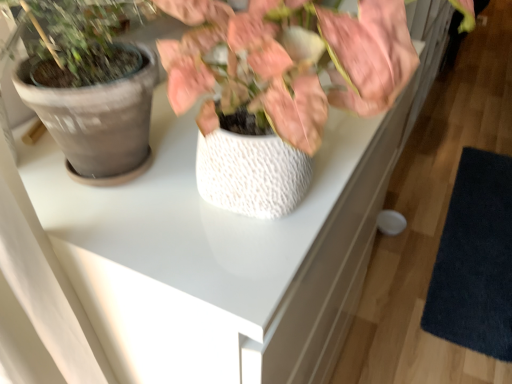
At what (x,y) coordinates should I click in order to perform the action: click on white textured pot at center. Please return your answer as a coordinate pair (x, y). The width and height of the screenshot is (512, 384). Looking at the image, I should click on (289, 61).

Describe the element at coordinates (289, 61) in the screenshot. Image resolution: width=512 pixels, height=384 pixels. I see `white textured pot at center` at that location.

The width and height of the screenshot is (512, 384). Describe the element at coordinates (475, 259) in the screenshot. I see `dark blue textured mat at lower right` at that location.

I want to click on dark blue textured mat at lower right, so click(475, 259).

In order to face dark blue textured mat at lower right, should I rotate leftwards or rightwards?

You should look right and rotate roughly 27.688 degrees.

Locate an element on the screen. white textured pot at center is located at coordinates (289, 61).

Considering the positions of objects white textured pot at center and dark blue textured mat at lower right in the image provided, who is more to the left, white textured pot at center or dark blue textured mat at lower right?

Positioned to the left is white textured pot at center.

Does white textured pot at center lie behind dark blue textured mat at lower right?

That is False.

Considering the points (391, 54) and (449, 308), which point is in front, point (391, 54) or point (449, 308)?

Point (391, 54)

From the image's perspective, is white textured pot at center over dark blue textured mat at lower right?

Indeed, from the image's perspective, white textured pot at center is shown above dark blue textured mat at lower right.

From a real-world perspective, which is physically above, white textured pot at center or dark blue textured mat at lower right?

white textured pot at center, from a real-world perspective.

Which object is thinner, white textured pot at center or dark blue textured mat at lower right?

Thinner between the two is white textured pot at center.

Is white textured pot at center taller than dark blue textured mat at lower right?

Yes, white textured pot at center is taller than dark blue textured mat at lower right.

Between white textured pot at center and dark blue textured mat at lower right, which one has smaller size?

With smaller size is white textured pot at center.

Is white textured pot at center located outside dark blue textured mat at lower right?

Yes, white textured pot at center is not within dark blue textured mat at lower right.

Are white textured pot at center and dark blue textured mat at lower right far apart?

Yes, white textured pot at center is far from dark blue textured mat at lower right.

From the picture: Does white textured pot at center turn towards dark blue textured mat at lower right?

No.

How far apart are white textured pot at center and dark blue textured mat at lower right?

A distance of 5.22 feet exists between white textured pot at center and dark blue textured mat at lower right.

In order to click on mat located behind the white textured pot at center in this screenshot , I will do `click(475, 259)`.

Is dark blue textured mat at lower right at the left side of white textured pot at center?

No.

Is dark blue textured mat at lower right in front of white textured pot at center?

That is False.

Is point (424, 322) positioned behind point (297, 37)?

Yes, point (424, 322) is behind point (297, 37).

From the image's perspective, is dark blue textured mat at lower right located above white textured pot at center?

No, from the image's perspective, dark blue textured mat at lower right is not above white textured pot at center.

From a real-world perspective, does dark blue textured mat at lower right sit lower than white textured pot at center?

Yes, from a real-world perspective, dark blue textured mat at lower right is beneath white textured pot at center.

Can you confirm if dark blue textured mat at lower right is thinner than white textured pot at center?

In fact, dark blue textured mat at lower right might be wider than white textured pot at center.

Which of these two, dark blue textured mat at lower right or white textured pot at center, stands taller?

With more height is white textured pot at center.

Based on their sizes in the image, would you say dark blue textured mat at lower right is bigger or smaller than white textured pot at center?

Clearly, dark blue textured mat at lower right is larger in size than white textured pot at center.

Can we say dark blue textured mat at lower right lies outside white textured pot at center?

Indeed, dark blue textured mat at lower right is completely outside white textured pot at center.

Is dark blue textured mat at lower right positioned far away from white textured pot at center?

dark blue textured mat at lower right is far away from white textured pot at center.

Could you tell me if dark blue textured mat at lower right is facing white textured pot at center?

No, dark blue textured mat at lower right does not turn towards white textured pot at center.

How far apart are dark blue textured mat at lower right and white textured pot at center?

dark blue textured mat at lower right is 1.59 meters away from white textured pot at center.

Where is `houseplant above the dark blue textured mat at lower right (from a real-world perspective)`? The width and height of the screenshot is (512, 384). houseplant above the dark blue textured mat at lower right (from a real-world perspective) is located at coordinates (289, 61).

In the image, there is a white textured pot at center. Identify the location of mat below it (from the image's perspective). This screenshot has height=384, width=512. (475, 259).

The width and height of the screenshot is (512, 384). I want to click on mat beneath the white textured pot at center (from a real-world perspective), so click(475, 259).